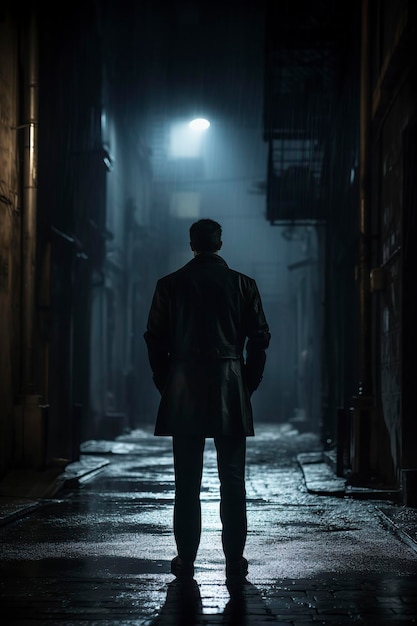
Locate an element on the screen. The width and height of the screenshot is (417, 626). wall is located at coordinates (15, 151).